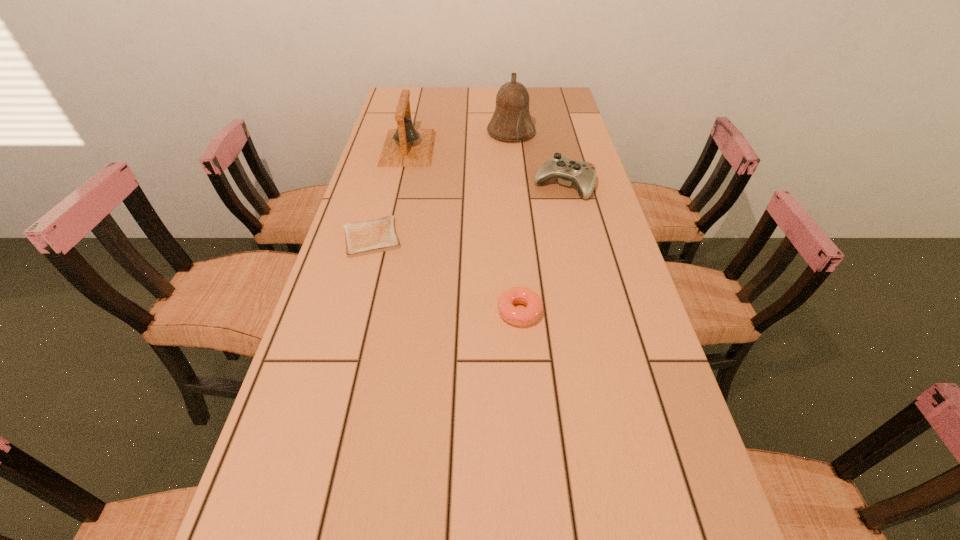
Where is `vacant region at the right edge of the desktop`? vacant region at the right edge of the desktop is located at coordinates (659, 464).

This screenshot has height=540, width=960. Identify the location of free space at the far right corner of the desktop. (563, 112).

The image size is (960, 540). Find the location of `vacant area between the shorter bell and the taller bell`. vacant area between the shorter bell and the taller bell is located at coordinates (460, 141).

Find the location of a particular element. The height and width of the screenshot is (540, 960). empty space that is in between the fourth farthest object and the shorter bell is located at coordinates (390, 193).

The image size is (960, 540). I want to click on free space between the toast and the taller bell, so click(442, 185).

Where is `free spot between the control and the fourth shortest object`? The width and height of the screenshot is (960, 540). free spot between the control and the fourth shortest object is located at coordinates click(486, 167).

The height and width of the screenshot is (540, 960). I want to click on free point between the left bell and the third shortest object, so click(x=486, y=167).

Identify the location of vacant space that's between the taller bell and the control. This screenshot has width=960, height=540. point(538,159).

You are a GUI agent. You are given a task and a screenshot of the screen. Output one action in this format:
    pyautogui.click(x=<x>, y=<y>)
    Task: Click on the free spot between the left bell and the tallest object
    Image resolution: width=960 pixels, height=540 pixels.
    Given the screenshot: What is the action you would take?
    pyautogui.click(x=460, y=141)

The height and width of the screenshot is (540, 960). I want to click on unoccupied position between the second nearest object and the doughnut, so click(445, 275).